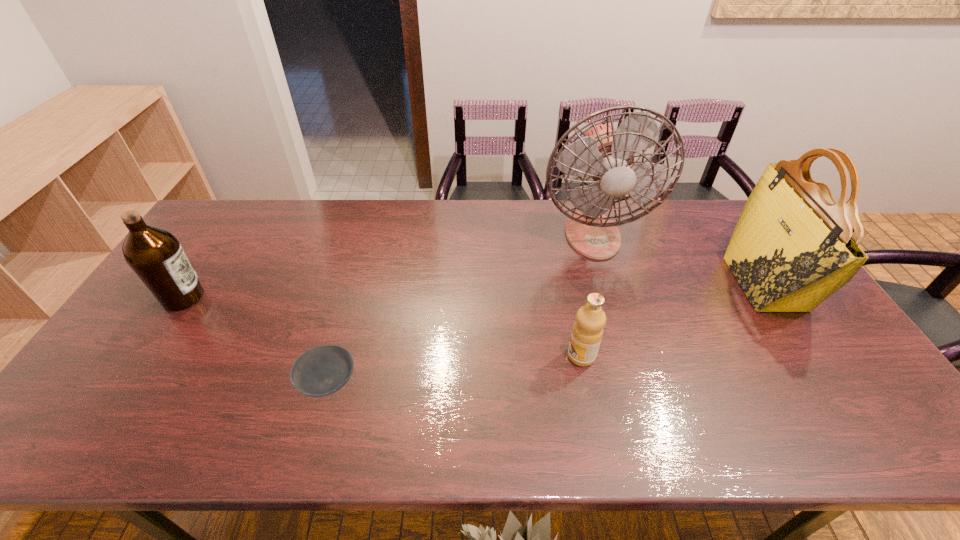
Identify the location of fan. Image resolution: width=960 pixels, height=540 pixels. (605, 154).

Find the location of a particular element. The width and height of the screenshot is (960, 540). tote bag is located at coordinates (793, 246).

Where is `the third tallest object`? This screenshot has height=540, width=960. the third tallest object is located at coordinates (156, 256).

I want to click on the taller olive oil, so click(156, 256).

The height and width of the screenshot is (540, 960). In order to click on the right olive oil in this screenshot , I will do `click(587, 332)`.

What are the coordinates of `the second shortest object` in the screenshot? It's located at (587, 332).

Find the location of a particular element. The width and height of the screenshot is (960, 540). bowl is located at coordinates (321, 371).

Where is `the second object from left to right`? The width and height of the screenshot is (960, 540). the second object from left to right is located at coordinates (321, 371).

Identify the location of vacant area situated in front of the fan to direct airflow. (612, 305).

This screenshot has width=960, height=540. What are the coordinates of `vacant space situated on the front-facing side of the rightmost object` in the screenshot? It's located at (652, 284).